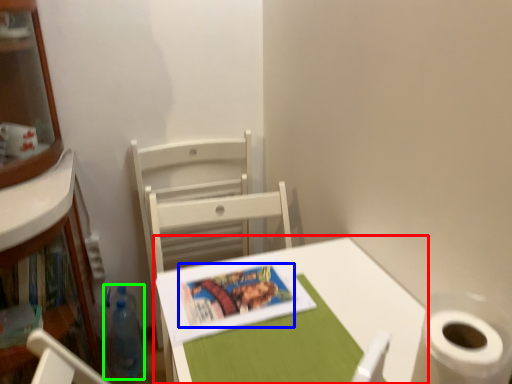
Question: Which object is positioned closest to table (highlighted by a red box)? Select from book cover (highlighted by a blue box) and bottle (highlighted by a green box).

Choices:
 (A) book cover
 (B) bottle

Answer: (A)